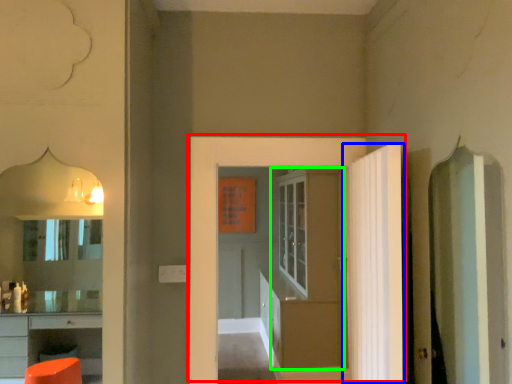
Question: Considering the real-world distances, which object is closest to door (highlighted by a red box)? door (highlighted by a blue box) or door (highlighted by a green box).

Choices:
 (A) door
 (B) door

Answer: (A)